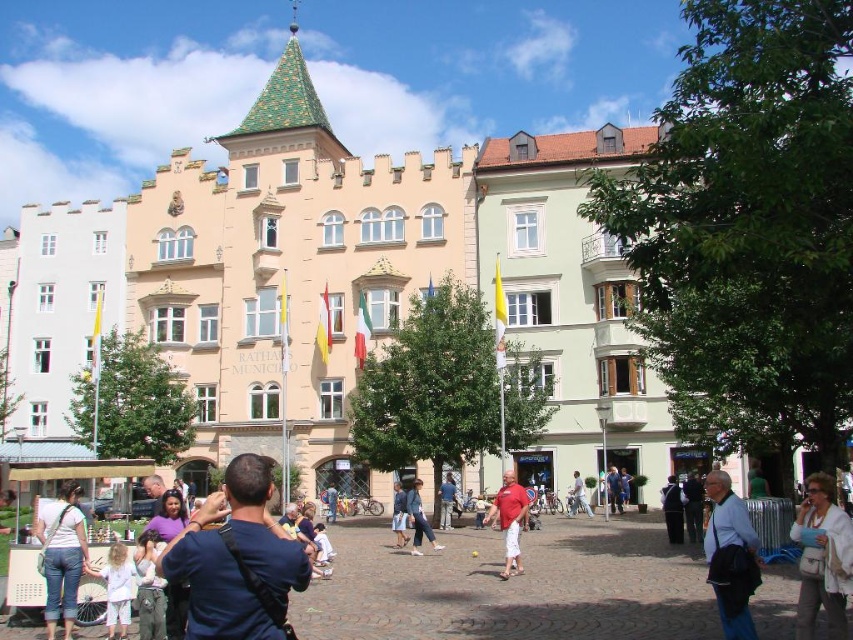
Is denim shorts at lower left above matte red shirt at center?

A: Correct, denim shorts at lower left is located above matte red shirt at center.

Is point (59, 605) positioned after point (515, 566)?

That is False.

Identify the location of denim shorts at lower left. (62, 556).

Is white fabric purse at center taller than light blue shirt at center?

Indeed, white fabric purse at center has a greater height compared to light blue shirt at center.

Is point (822, 561) in front of point (579, 481)?

Yes, it is in front of point (579, 481).

Image resolution: width=853 pixels, height=640 pixels. I want to click on white fabric purse at center, so click(x=820, y=557).

Is black leather jacket at lower right smaller than denim jacket at center?

Correct, black leather jacket at lower right occupies less space than denim jacket at center.

Is point (675, 532) less distant than point (422, 513)?

Yes, it is in front of point (422, 513).

Image resolution: width=853 pixels, height=640 pixels. What are the coordinates of `black leather jacket at lower right` in the screenshot? It's located at (672, 509).